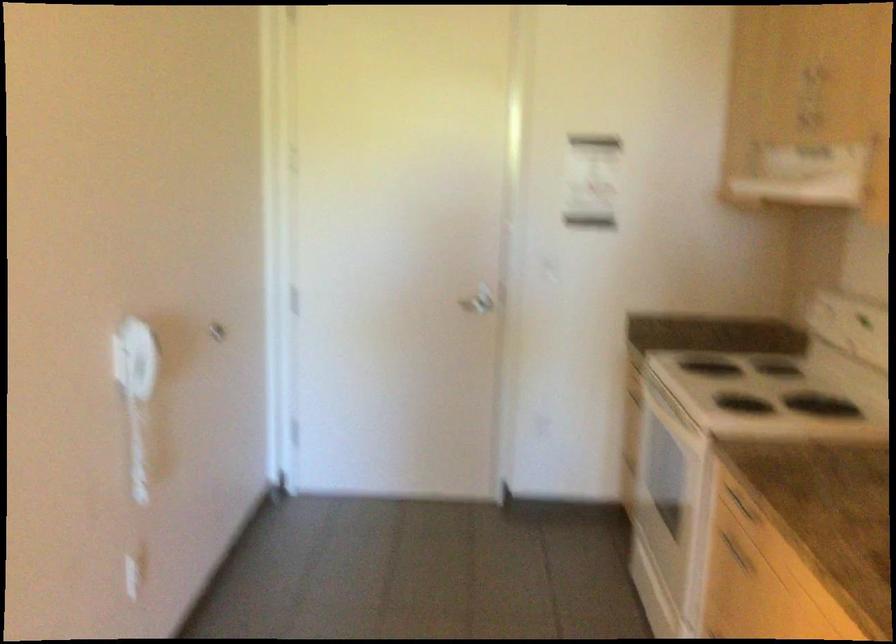
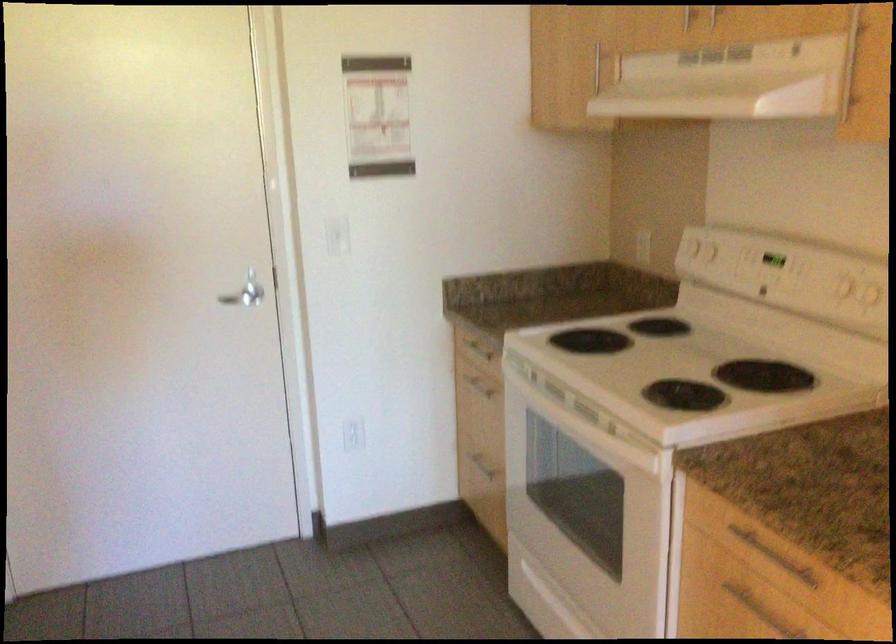
Question: What movement of the cameraman would produce the second image?

Choices:
 (A) Left
 (B) Right
 (C) Forward
 (D) Backward

Answer: (C)